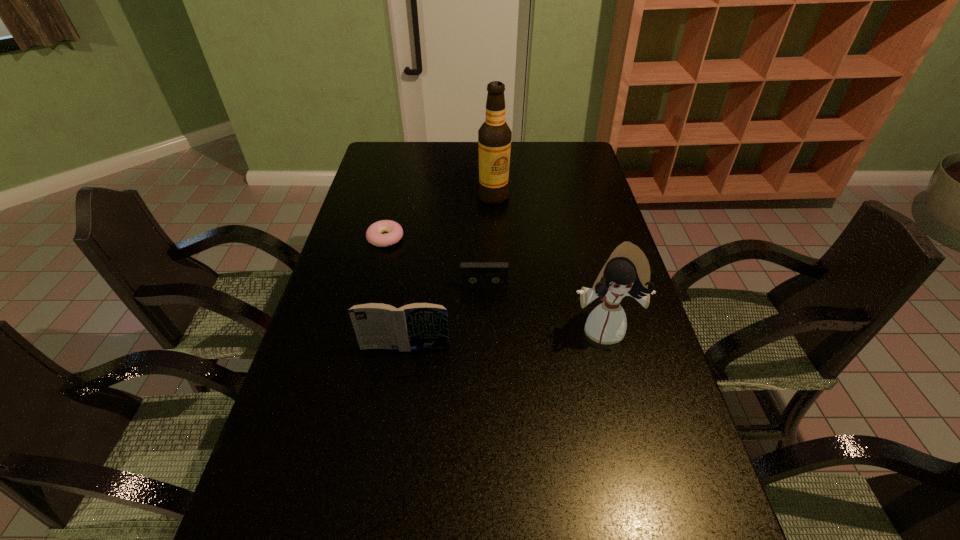
Identify the location of vacant space located 0.130m at the front face of the second tallest object. [619, 392].

Find the location of a particular element. This screenshot has width=960, height=540. blank space located on the front cover of the third shortest object is located at coordinates (391, 448).

This screenshot has width=960, height=540. Identify the location of free space located on the front-facing side of the second shortest object. (485, 334).

In order to click on vacant space located on the left of the fourth nearest object in this screenshot , I will do `click(349, 238)`.

Where is `book located in the left edge section of the desktop`? This screenshot has height=540, width=960. book located in the left edge section of the desktop is located at coordinates (414, 326).

Where is `doughnut that is at the left edge`? Image resolution: width=960 pixels, height=540 pixels. doughnut that is at the left edge is located at coordinates (393, 231).

What are the coordinates of `object that is at the right edge` in the screenshot? It's located at (627, 272).

At what (x,y) coordinates should I click in order to perform the action: click on free space at the far edge of the desktop. Please return your answer as a coordinate pair (x, y). The image size is (960, 540). Looking at the image, I should click on (444, 152).

I want to click on free space at the left edge, so click(x=338, y=295).

At what (x,y) coordinates should I click in order to perform the action: click on vacant area at the right edge. Please return your answer as a coordinate pair (x, y). The width and height of the screenshot is (960, 540). Looking at the image, I should click on (615, 246).